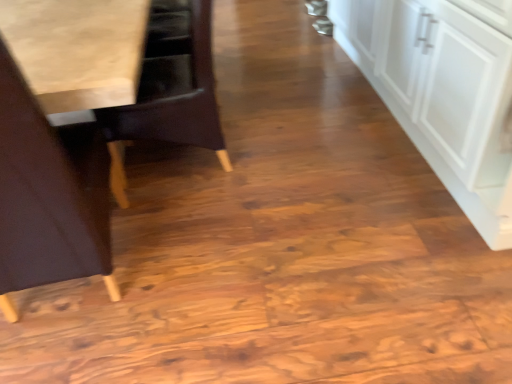
Identify the location of free spot to the right of light brown wood chair at left, arranged as the first chair when viewed from the front. This screenshot has height=384, width=512. (190, 262).